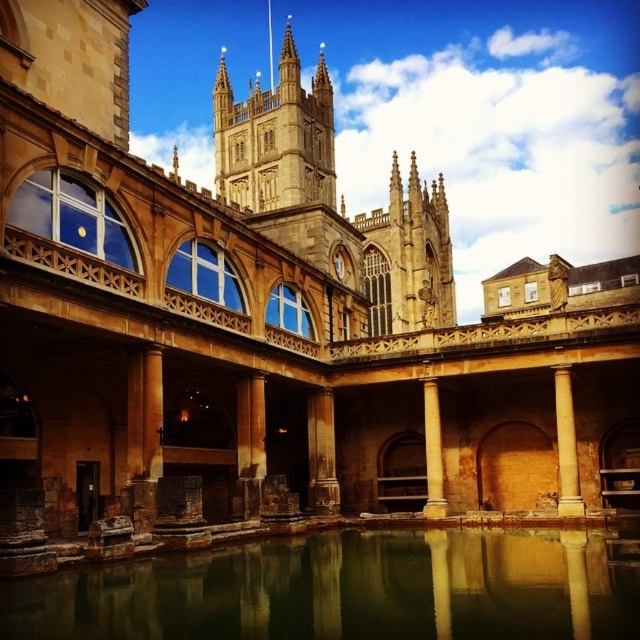
Based on the photo, you are standing at the point marked as point (321,452) in the Roman bath complex. What object is located exactly at this point?

The brown stone column at center is located exactly at point (321,452).

You are an architect examining this Roman bath complex. You notice the greenish stone water at center and the brown stone column at center. From your vantage point, which object appears closer to you?

The greenish stone water at center appears closer because it is positioned in front of the brown stone column at center.